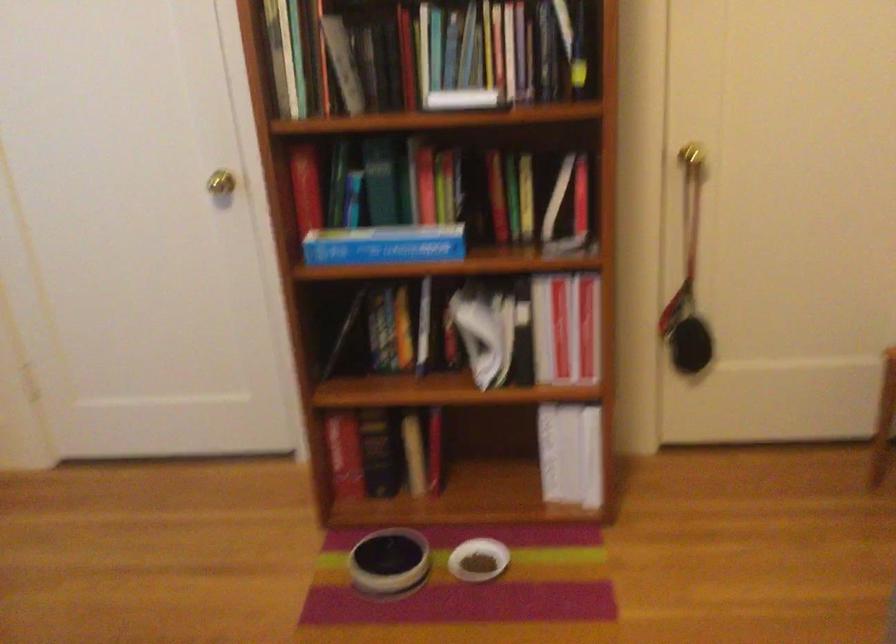
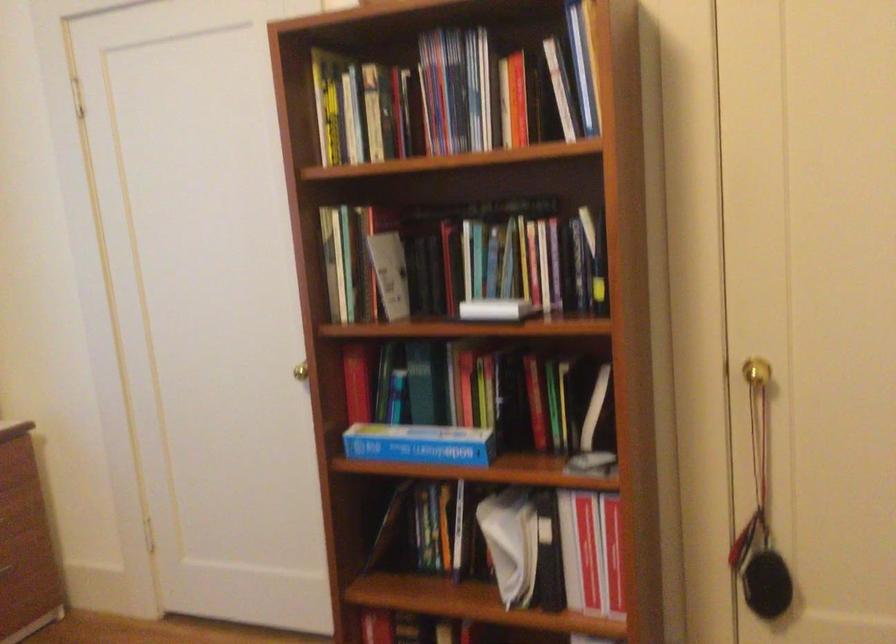
Find the pixel in the second image that matches (691,281) in the first image.

(762, 509)